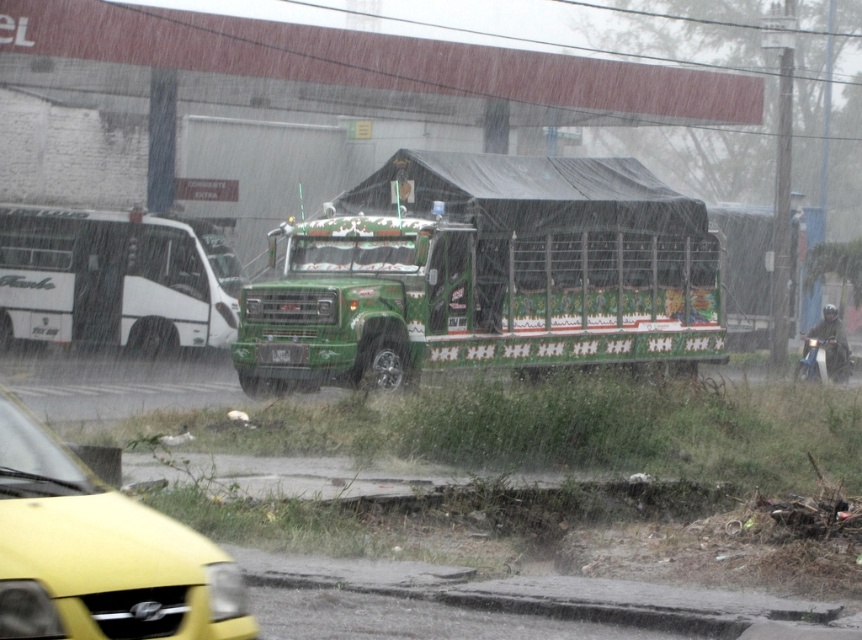
You are standing at point (484, 275) in the rainy urban street scene. What object is located exactly at your position?

The green painted metal trailer truck at center is located exactly at point (484, 275).

You are a pedestrian trying to cross the street in the rainy scene. You see the green painted metal trailer truck at center and the yellow matte car at lower left. Which vehicle is closer to you?

The green painted metal trailer truck at center is smaller than the yellow matte car at lower left, so the yellow matte car at lower left is closer to you since smaller objects in the distance appear smaller while larger ones are closer.